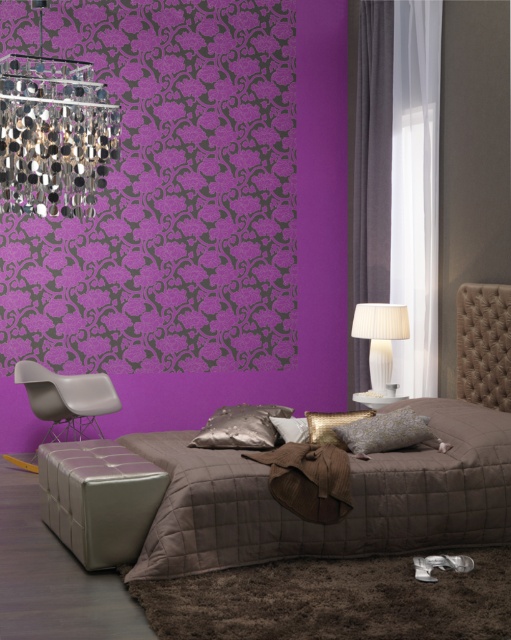
Who is lower down, brown quilted bed at center or purple velvet curtain at right?

brown quilted bed at center is lower down.

Identify the location of brown quilted bed at center. (354, 477).

I want to click on brown quilted bed at center, so click(354, 477).

Image resolution: width=511 pixels, height=640 pixels. I want to click on brown quilted bed at center, so click(354, 477).

Which is below, metallic silver chandelier at upper left or gold textured pillow at center?

gold textured pillow at center is lower down.

Measure the distance between metallic silver chandelier at upper left and camera.

A distance of 20.80 feet exists between metallic silver chandelier at upper left and camera.

Locate an element on the screen. Image resolution: width=511 pixels, height=640 pixels. metallic silver chandelier at upper left is located at coordinates (170, 198).

Is metallic silver pillow at center in front of satin gray pillow at center?

Yes, it is in front of satin gray pillow at center.

Is point (203, 432) closer to viewer compared to point (297, 438)?

Yes, point (203, 432) is closer to viewer.

Describe the element at coordinates (242, 428) in the screenshot. I see `metallic silver pillow at center` at that location.

This screenshot has height=640, width=511. Find the location of `metallic silver pillow at center`. metallic silver pillow at center is located at coordinates (242, 428).